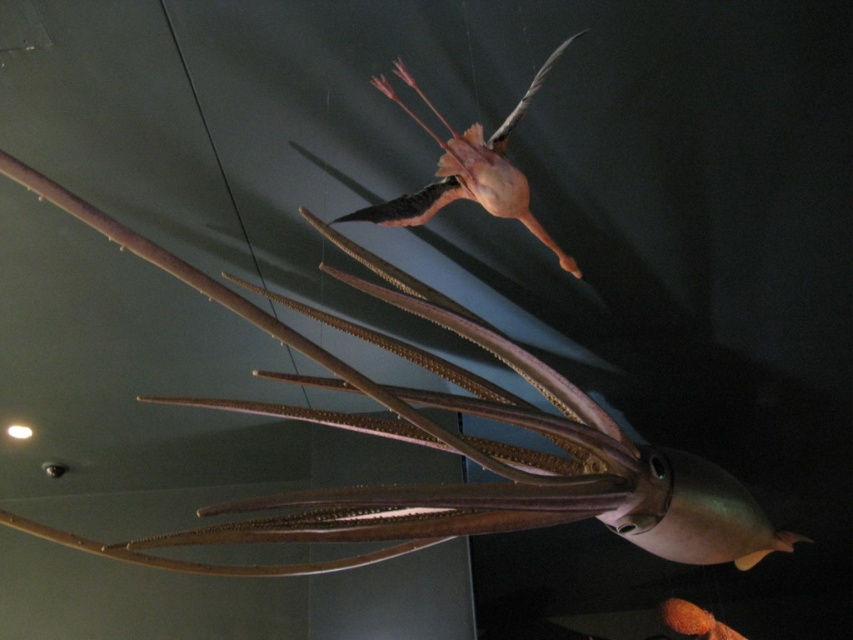
Can you confirm if shiny metallic squid at upper center is taller than pink matte squid at upper center?

Yes, shiny metallic squid at upper center is taller than pink matte squid at upper center.

Does point (421, 502) come in front of point (521, 198)?

Yes, it is in front of point (521, 198).

Describe the element at coordinates (442, 442) in the screenshot. This screenshot has width=853, height=640. I see `shiny metallic squid at upper center` at that location.

What are the coordinates of `shiny metallic squid at upper center` in the screenshot? It's located at (442, 442).